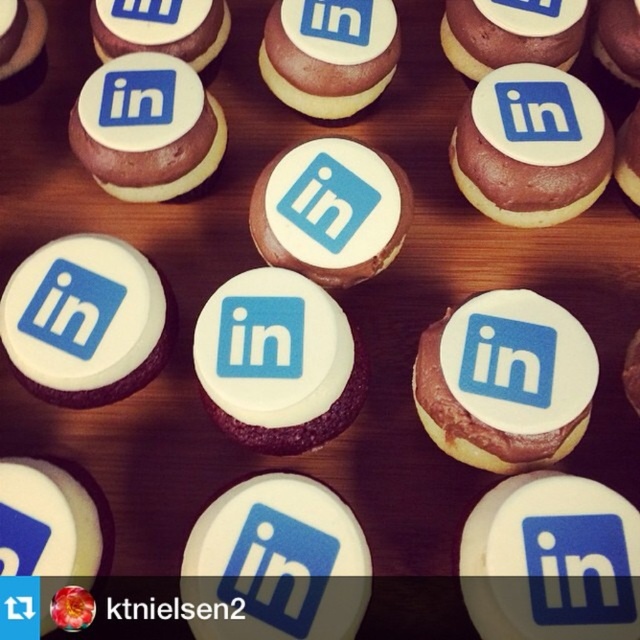
Question: Is matte chocolate cupcake at center above white glossy cupcake at center?

Choices:
 (A) yes
 (B) no

Answer: (B)

Question: Which object is the farthest from the matte white cookie at center?

Choices:
 (A) matte white cupcake at upper center
 (B) matte chocolate cupcake at upper right

Answer: (B)

Question: Among these points, which one is farthest from the camera?

Choices:
 (A) (548, 310)
 (B) (13, 304)
 (C) (324, 244)
 (D) (109, 140)

Answer: (D)

Question: Which point is farther to the camera?

Choices:
 (A) matte chocolate cupcake at upper right
 (B) white glossy cupcake at center-left
 (C) white glossy cupcake at center

Answer: (A)

Question: Does matte chocolate cupcake at center appear over matte white cookie at center?

Choices:
 (A) no
 (B) yes

Answer: (A)

Question: Is matte white cookie at center positioned in front of matte white cupcake at upper center?

Choices:
 (A) yes
 (B) no

Answer: (A)